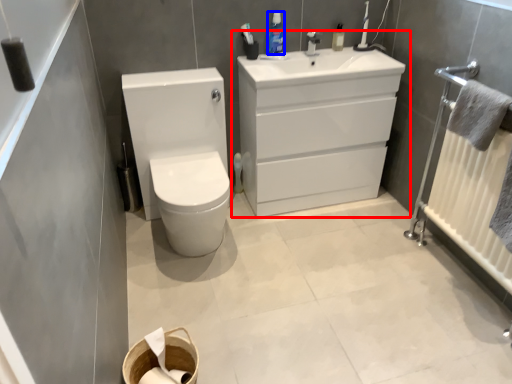
Question: Which of the following is the farthest to the observer, bathroom cabinet (highlighted by a red box) or mouthwash (highlighted by a blue box)?

Choices:
 (A) bathroom cabinet
 (B) mouthwash

Answer: (B)